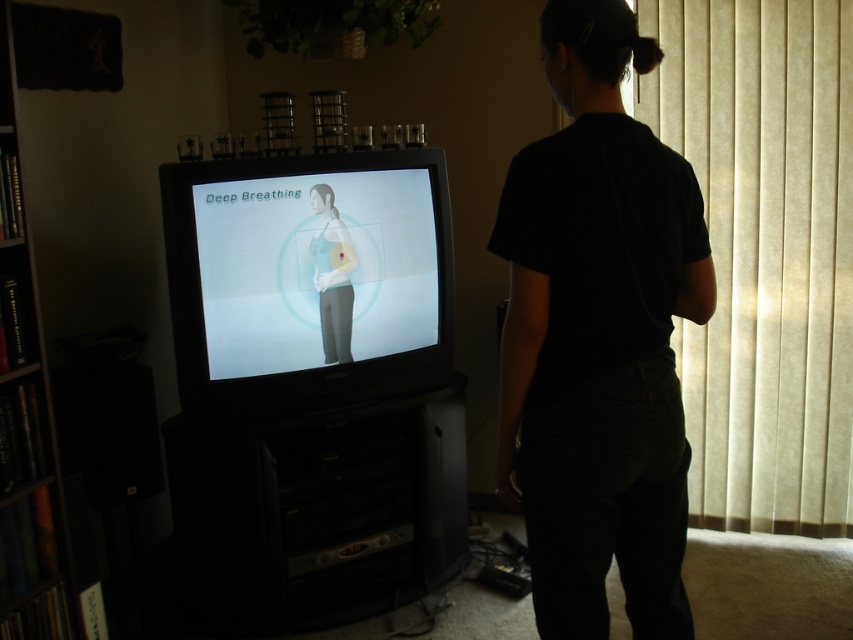
Question: Which object appears closest to the camera in this image?

Choices:
 (A) matte gray tank top at center
 (B) beige fabric curtain at right
 (C) black cotton shirt at center

Answer: (C)

Question: Is beige fabric curtain at right further to camera compared to matte gray tank top at center?

Choices:
 (A) no
 (B) yes

Answer: (B)

Question: Among these objects, which one is nearest to the camera?

Choices:
 (A) wooden bookshelf at left
 (B) black plastic entertainment center at lower center
 (C) matte gray tank top at center

Answer: (A)

Question: Which point is closer to the camera?

Choices:
 (A) (332, 192)
 (B) (184, 435)
 (C) (839, 38)

Answer: (B)

Question: Considering the relative positions of black cotton shirt at center and black plastic entertainment center at lower center in the image provided, where is black cotton shirt at center located with respect to black plastic entertainment center at lower center?

Choices:
 (A) right
 (B) left

Answer: (A)

Question: Considering the relative positions of beige fabric curtain at right and wooden bookshelf at left in the image provided, where is beige fabric curtain at right located with respect to wooden bookshelf at left?

Choices:
 (A) above
 (B) below

Answer: (A)